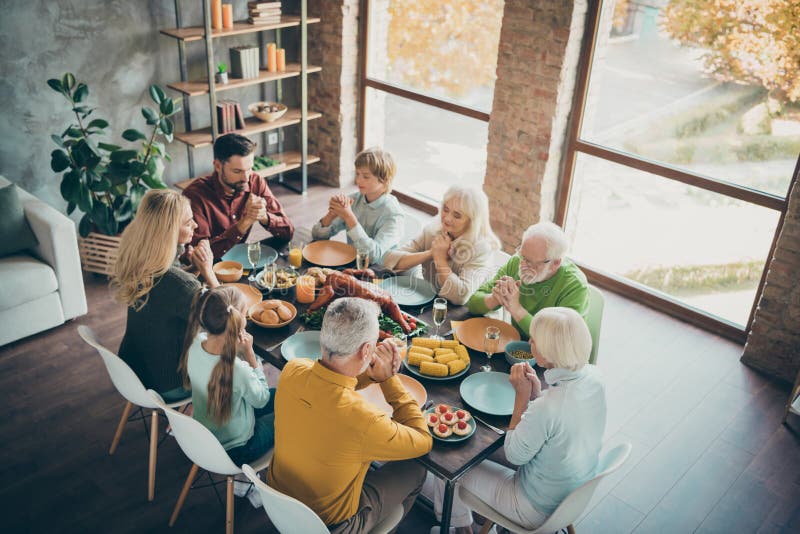
Image resolution: width=800 pixels, height=534 pixels. Find the location of `sections of walls`. sections of walls is located at coordinates (102, 38), (326, 48), (528, 83), (778, 260).